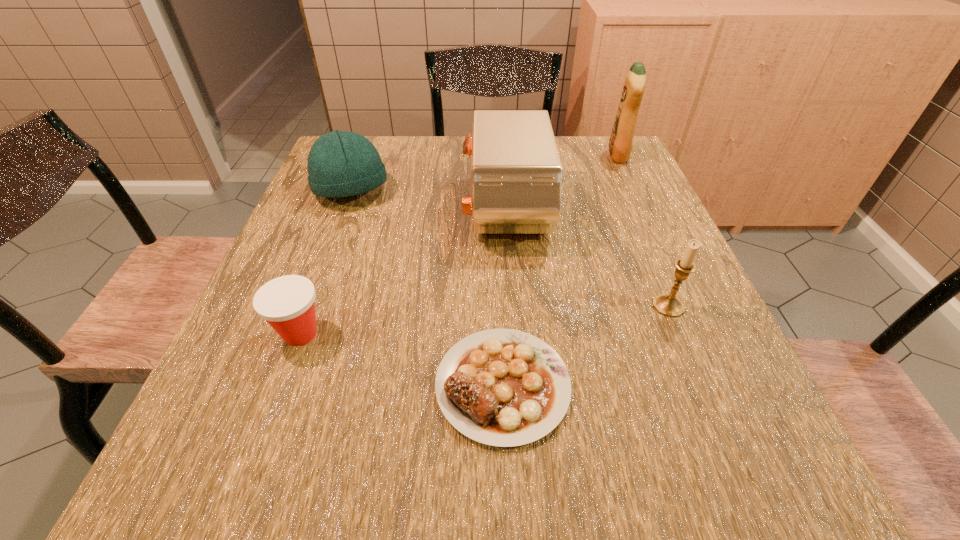
At what (x,y) coordinates should I click in order to perform the action: click on vacant space located on the door side of the toaster oven. Please return your answer as a coordinate pair (x, y). Looking at the image, I should click on (345, 211).

What are the coordinates of `vacant space located on the door side of the toaster oven` in the screenshot? It's located at (419, 211).

The image size is (960, 540). In order to click on vacant space located on the door side of the toaster oven in this screenshot , I will do `click(381, 211)`.

At what (x,y) coordinates should I click in order to perform the action: click on free location located on the left of the candle holder. Please return your answer as a coordinate pair (x, y). Looking at the image, I should click on (491, 306).

The width and height of the screenshot is (960, 540). I want to click on vacant space located 0.060m on the front of the beanie, so click(337, 228).

Locate an element on the screen. The height and width of the screenshot is (540, 960). vacant space located on the right of the second shortest object is located at coordinates (526, 333).

Image resolution: width=960 pixels, height=540 pixels. Find the location of `free space located on the right of the shortest object`. free space located on the right of the shortest object is located at coordinates (637, 385).

Locate an element on the screen. The width and height of the screenshot is (960, 540). detergent situated at the far edge is located at coordinates point(621,141).

This screenshot has height=540, width=960. Identify the location of toaster oven located in the far edge section of the desktop. (516, 174).

The width and height of the screenshot is (960, 540). Identify the location of beanie at the far edge. coord(340,163).